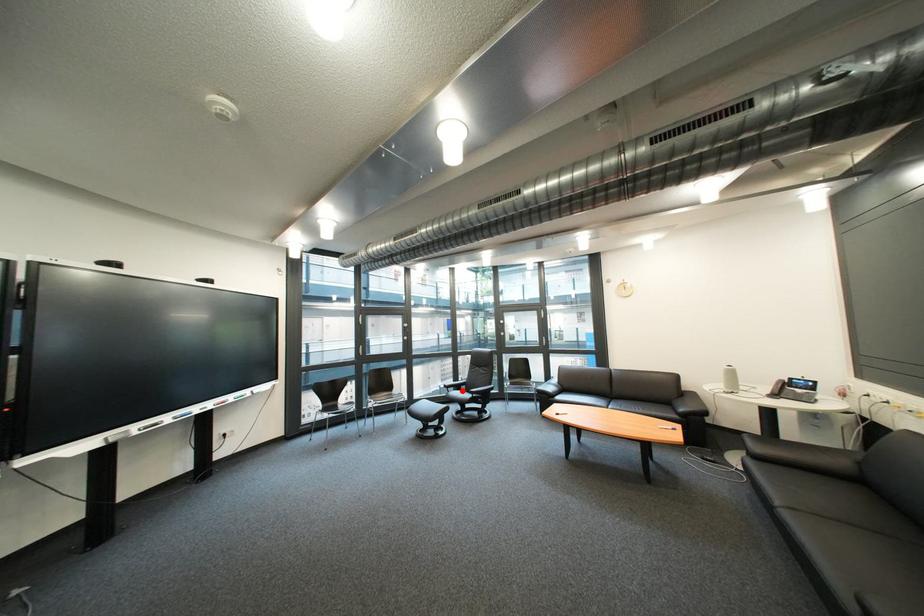
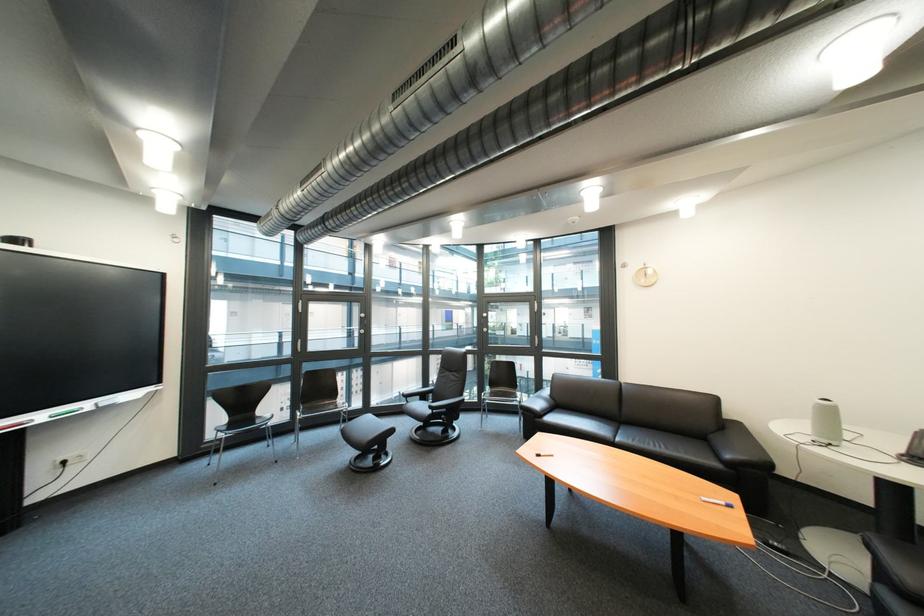
Question: I am providing you with two images of the same scene from different viewpoints. A red point is shown in image1. For the corresponding object point in image2, is it positioned nearer or farther from the camera?

Choices:
 (A) Nearer
 (B) Farther

Answer: (A)